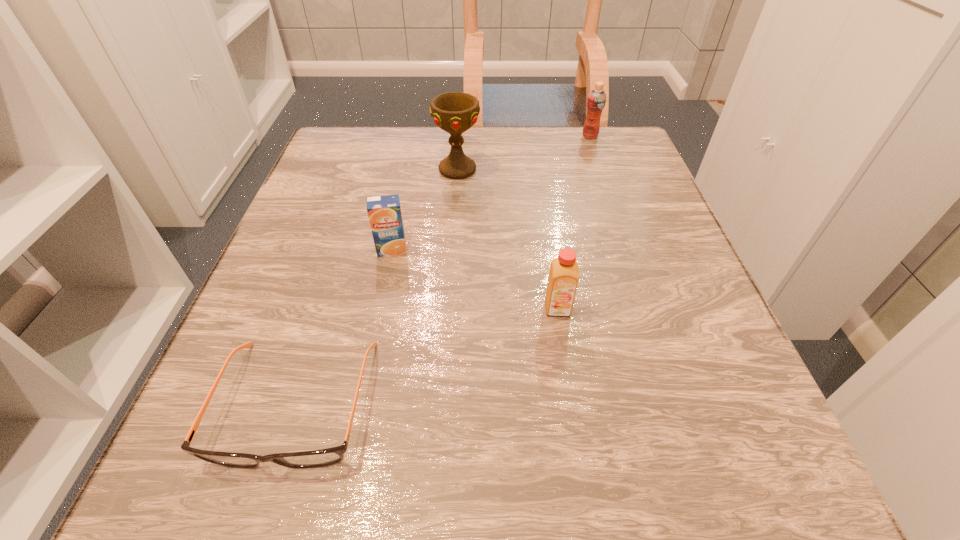
Where is `free area in between the third farthest object and the farthest object`? The width and height of the screenshot is (960, 540). free area in between the third farthest object and the farthest object is located at coordinates (491, 193).

The image size is (960, 540). I want to click on free space between the second farthest orange_juice and the farthest orange_juice, so click(x=491, y=193).

Where is `vacant space that's between the nearest object and the third farthest object`? This screenshot has width=960, height=540. vacant space that's between the nearest object and the third farthest object is located at coordinates (344, 326).

Image resolution: width=960 pixels, height=540 pixels. I want to click on vacant area between the second orange_juice from left to right and the farthest object, so click(574, 222).

You are a GUI agent. You are given a task and a screenshot of the screen. Output one action in this format:
    pyautogui.click(x=<x>, y=<y>)
    Task: Click on the vacant area that lies between the rightmost orange_juice and the second nearest object
    The height and width of the screenshot is (540, 960).
    Given the screenshot: What is the action you would take?
    pyautogui.click(x=574, y=222)

Identify the location of free space between the nearest object and the rightmost orange_juice. (444, 269).

Select which object is the fourth closest to the second orange_juice from left to right. Please provide its 2D coordinates. Your answer should be formatted as a tuple, i.e. [(x, y)], where the tuple contains the x and y coordinates of a point satisfying the conditions above.

[(596, 100)]

Identify the location of object that stands as the closest to the nearest orange_juice. (384, 212).

Find the location of a particular element. The width and height of the screenshot is (960, 540). orange_juice that is the second closest to the third farthest object is located at coordinates (596, 100).

Identify the location of the second closest orange_juice relative to the third nearest object. The image size is (960, 540). (596, 100).